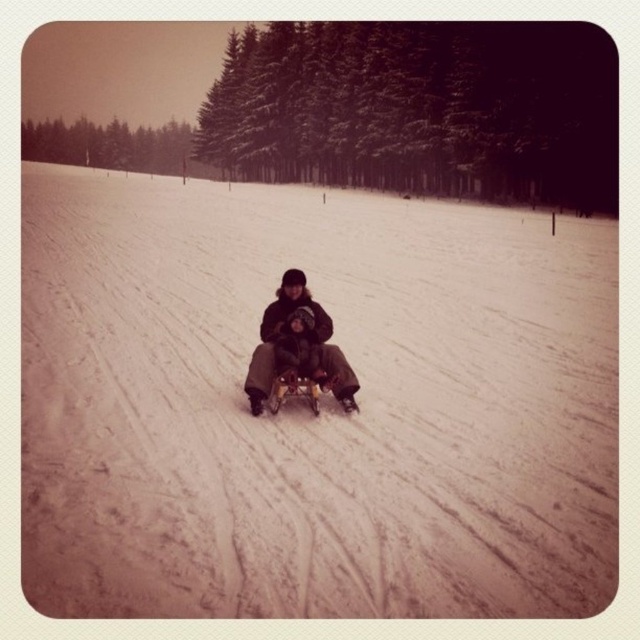
You are standing at the origin point of the coordinate system in the image. You want to reach the white powdery snow at center. What are the coordinates you need to move to?

The coordinates to reach the white powdery snow at center are at point (307, 412).

You are standing at the top of the slope and see the white powdery snow at center and the dark brown fabric snowboard at center. Which object is nearer to you?

The white powdery snow at center is closer to the viewer than the dark brown fabric snowboard at center, so the white powdery snow at center is nearer to you.